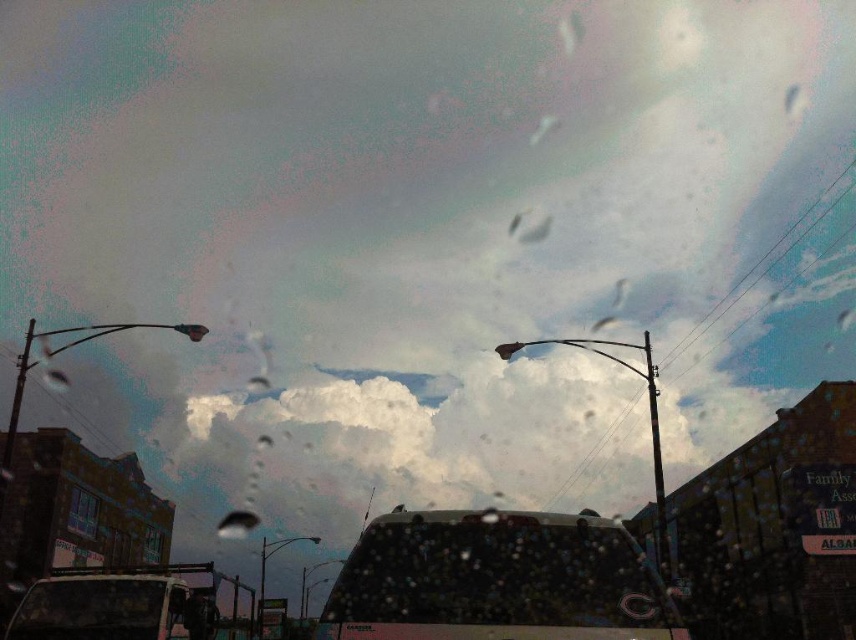
Question: Does dark matte car at center appear on the left side of matte black van at lower left?

Choices:
 (A) yes
 (B) no

Answer: (B)

Question: Which object appears closest to the camera in this image?

Choices:
 (A) matte black van at lower left
 (B) dark matte car at center

Answer: (B)

Question: Which point is closer to the camera?

Choices:
 (A) matte black van at lower left
 (B) dark matte car at center

Answer: (B)

Question: Is dark matte car at center positioned behind matte black van at lower left?

Choices:
 (A) yes
 (B) no

Answer: (B)

Question: Which of the following is the farthest from the observer?

Choices:
 (A) (37, 611)
 (B) (394, 589)

Answer: (A)

Question: Does dark matte car at center come in front of matte black van at lower left?

Choices:
 (A) no
 (B) yes

Answer: (B)